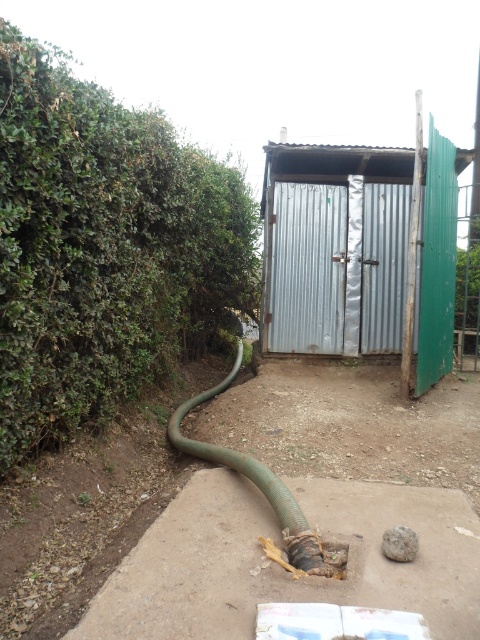
You are standing in front of the shed and see the point marked at coordinates (103, 248). Based on the scene description, can you identify what this point is located on?

The point at coordinates (103, 248) is located on the green leafy hedge at left.

You are standing in front of the shed and want to walk to the metallic corrugated hut at center. Which direction should you walk to avoid the green leafy hedge at left?

You should walk to the right side of the metallic corrugated hut at center to avoid the green leafy hedge at left, since the hedge is on its left side.